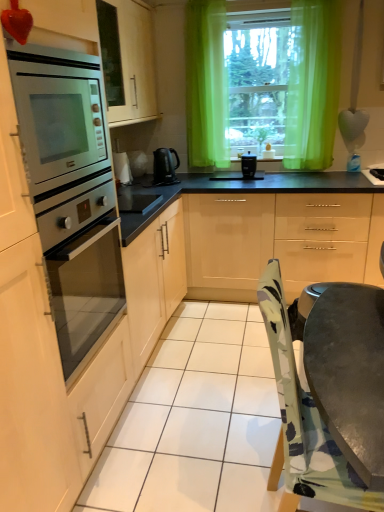
Question: Does point (221, 211) appear closer or farther from the camera than point (125, 211)?

Choices:
 (A) closer
 (B) farther

Answer: (B)

Question: Would you say glossy beige cabinets at center is to the left or to the right of black glass cooktop at center in the picture?

Choices:
 (A) left
 (B) right

Answer: (B)

Question: Which object is positioned closest to the glossy beige cabinets at center?

Choices:
 (A) stainless steel oven at left
 (B) green sheer curtain at upper center
 (C) black plastic coffee maker at center
 (D) black plastic kettle at center
 (E) green sheer curtains at upper center

Answer: (C)

Question: Which object is positioned closest to the glossy beige cabinets at center?

Choices:
 (A) green sheer curtains at upper center
 (B) black plastic coffee maker at center
 (C) black glass cooktop at center
 (D) black plastic kettle at center
 (E) stainless steel oven at left

Answer: (B)